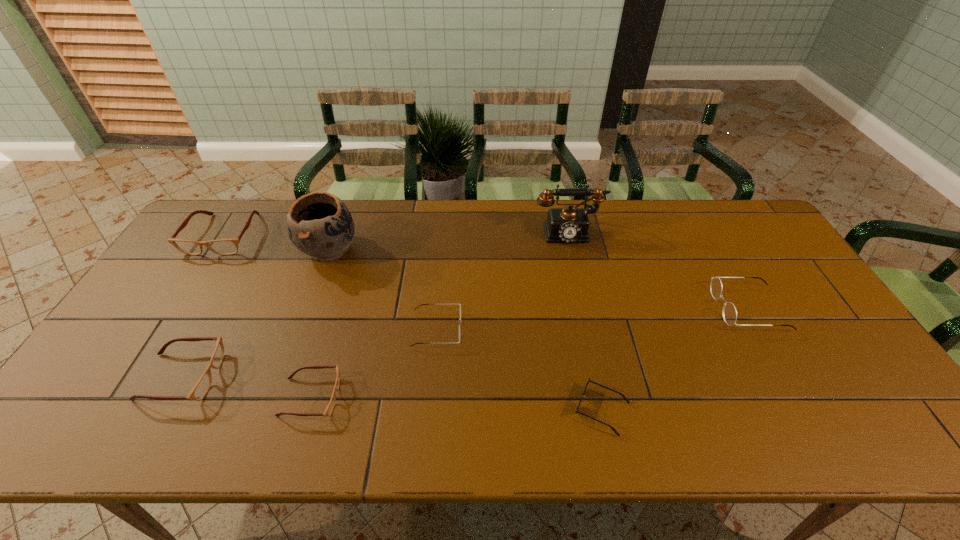
The image size is (960, 540). Find the location of `vacant space located on the front-facing side of the smaller black spectacles`. vacant space located on the front-facing side of the smaller black spectacles is located at coordinates (555, 329).

At what (x,y) coordinates should I click in order to perform the action: click on vacant region located on the front-facing side of the rightmost brown spectacles. Please return your answer as a coordinate pair (x, y). Looking at the image, I should click on click(394, 397).

At what (x,y) coordinates should I click in order to perform the action: click on vacant space located 0.350m on the lenses of the black sunglasses. Please return your answer as a coordinate pair (x, y). Image resolution: width=960 pixels, height=540 pixels. Looking at the image, I should click on pyautogui.click(x=420, y=410).

The height and width of the screenshot is (540, 960). I want to click on free space located 0.340m on the lenses of the black sunglasses, so click(425, 410).

The image size is (960, 540). I want to click on vacant space situated 0.380m on the lenses of the black sunglasses, so click(x=408, y=410).

Identify the location of telephone positioned at the far edge. This screenshot has width=960, height=540. (569, 224).

Find the location of a particular element. pottery that is positioned at the far edge is located at coordinates (319, 224).

In order to click on spectacles located in the far edge section of the desktop in this screenshot , I will do `click(223, 246)`.

This screenshot has height=540, width=960. Find the location of `spectacles situated at the near edge`. spectacles situated at the near edge is located at coordinates (329, 409).

I want to click on sunglasses situated at the near edge, so click(589, 380).